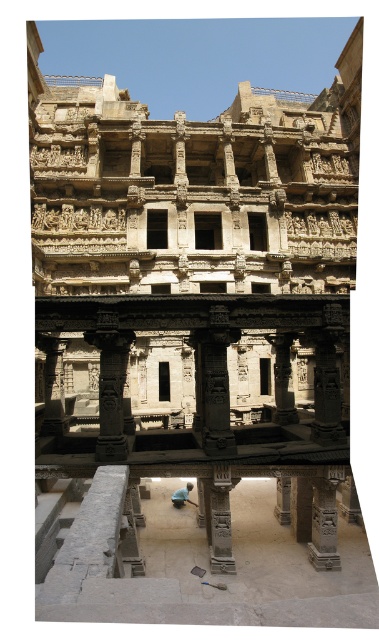
Question: Does carved stone pillar at center come behind light blue fabric at center?

Choices:
 (A) yes
 (B) no

Answer: (B)

Question: Is carved stone pillar at center further to camera compared to light blue fabric at center?

Choices:
 (A) no
 (B) yes

Answer: (A)

Question: Which of the following is the farthest from the observer?

Choices:
 (A) (109, 444)
 (B) (186, 493)

Answer: (B)

Question: Does carved stone pillar at center have a smaller size compared to light blue fabric at center?

Choices:
 (A) yes
 (B) no

Answer: (B)

Question: Among these points, which one is farthest from the camera?

Choices:
 (A) (187, 499)
 (B) (98, 336)

Answer: (A)

Question: Which point appears closest to the camera in this image?

Choices:
 (A) (122, 396)
 (B) (192, 484)

Answer: (A)